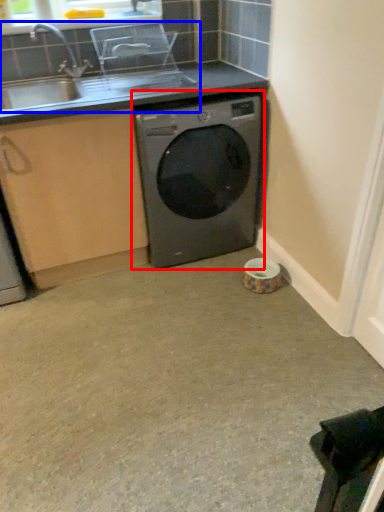
Question: Which object is further to the camera taking this photo, washing machine (highlighted by a red box) or sink (highlighted by a blue box)?

Choices:
 (A) washing machine
 (B) sink

Answer: (A)